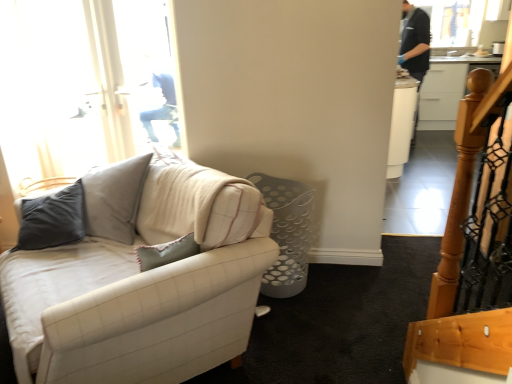
Question: Can you confirm if white glossy cabinet at upper right is shorter than white fabric couch at left?

Choices:
 (A) no
 (B) yes

Answer: (A)

Question: From a real-world perspective, is white glossy cabinet at upper right below white fabric couch at left?

Choices:
 (A) no
 (B) yes

Answer: (B)

Question: Considering the relative sizes of white glossy cabinet at upper right and white fabric couch at left in the image provided, is white glossy cabinet at upper right wider than white fabric couch at left?

Choices:
 (A) yes
 (B) no

Answer: (B)

Question: Considering the relative positions of white glossy cabinet at upper right and white fabric couch at left in the image provided, is white glossy cabinet at upper right to the right of white fabric couch at left from the viewer's perspective?

Choices:
 (A) no
 (B) yes

Answer: (B)

Question: Can you confirm if white glossy cabinet at upper right is bigger than white fabric couch at left?

Choices:
 (A) yes
 (B) no

Answer: (B)

Question: Is white glossy cabinet at upper right in front of white fabric couch at left?

Choices:
 (A) no
 (B) yes

Answer: (A)

Question: Is white glossy cabinet at upper right inside white fabric couch at left?

Choices:
 (A) yes
 (B) no

Answer: (B)

Question: Considering the relative sizes of white fabric couch at left and white glossy cabinet at upper right in the image provided, is white fabric couch at left shorter than white glossy cabinet at upper right?

Choices:
 (A) no
 (B) yes

Answer: (B)

Question: Does white fabric couch at left have a smaller size compared to white glossy cabinet at upper right?

Choices:
 (A) no
 (B) yes

Answer: (A)

Question: Does white fabric couch at left lie in front of white glossy cabinet at upper right?

Choices:
 (A) no
 (B) yes

Answer: (B)

Question: From the image's perspective, is white fabric couch at left over white glossy cabinet at upper right?

Choices:
 (A) no
 (B) yes

Answer: (A)

Question: Would you say white fabric couch at left is outside white glossy cabinet at upper right?

Choices:
 (A) yes
 (B) no

Answer: (A)

Question: Based on their positions, is white fabric couch at left located to the left or right of white glossy cabinet at upper right?

Choices:
 (A) left
 (B) right

Answer: (A)